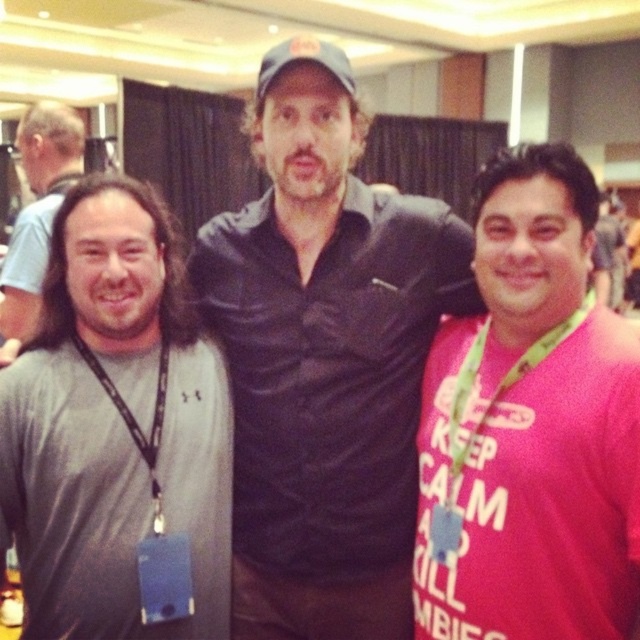
Is black matte shirt at center behind black lanyard at left?

That is True.

Is point (339, 225) positioned before point (150, 468)?

No.

At what (x,y) coordinates should I click in order to perform the action: click on black matte shirt at center. Please return your answer as a coordinate pair (x, y). Looking at the image, I should click on (324, 358).

Is black matte shirt at center to the left of pink fabric shirt at right from the viewer's perspective?

Indeed, black matte shirt at center is positioned on the left side of pink fabric shirt at right.

Which is more to the right, black matte shirt at center or pink fabric shirt at right?

From the viewer's perspective, pink fabric shirt at right appears more on the right side.

Find the location of a particular element. The image size is (640, 640). black matte shirt at center is located at coordinates (324, 358).

Find the location of a particular element. black matte shirt at center is located at coordinates (324, 358).

Which is in front, point (220, 268) or point (44, 150)?

Positioned in front is point (220, 268).

Measure the distance between point (307, 404) and camera.

4.64 feet

Looking at this image, who is more forward, (340, 333) or (58, 189)?

Positioned in front is point (340, 333).

Where is `black matte shirt at center`? black matte shirt at center is located at coordinates click(324, 358).